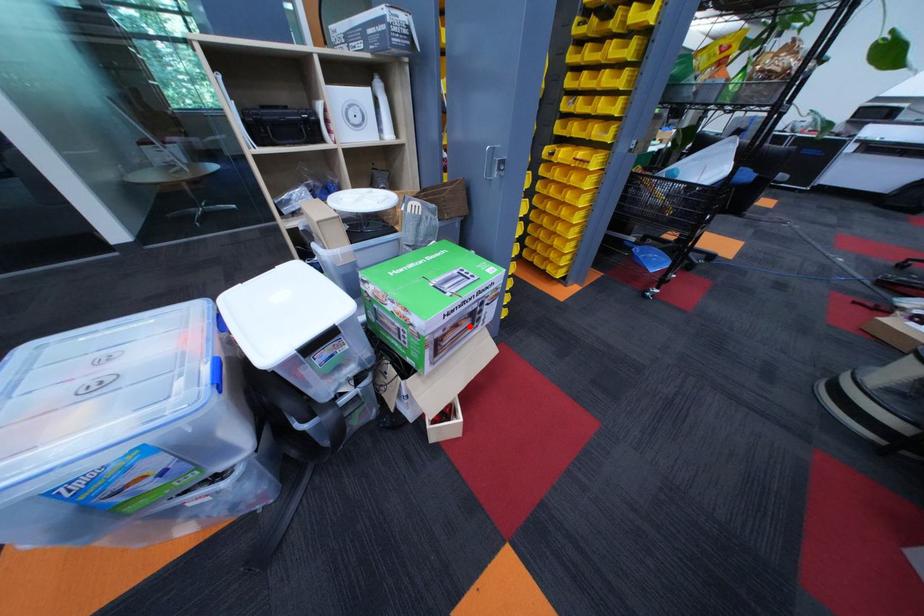
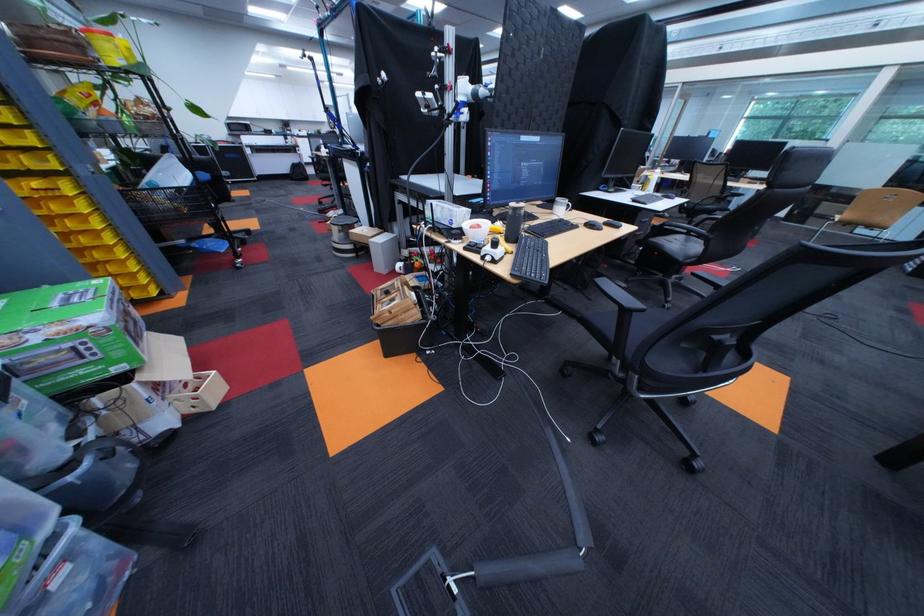
Locate, in the second image, the point that corresponds to the highlighted location in the first image.

(139, 322)